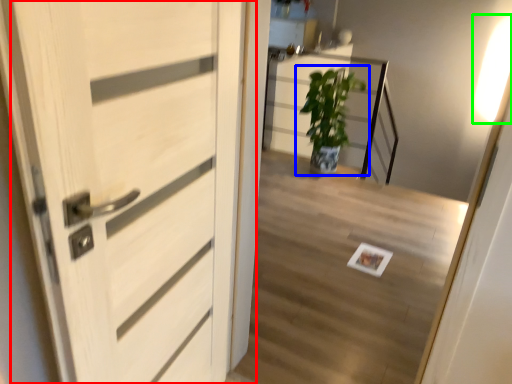
Question: Which object is the farthest from door (highlighted by a red box)? Choose among these: houseplant (highlighted by a blue box) or light (highlighted by a green box).

Choices:
 (A) houseplant
 (B) light

Answer: (B)